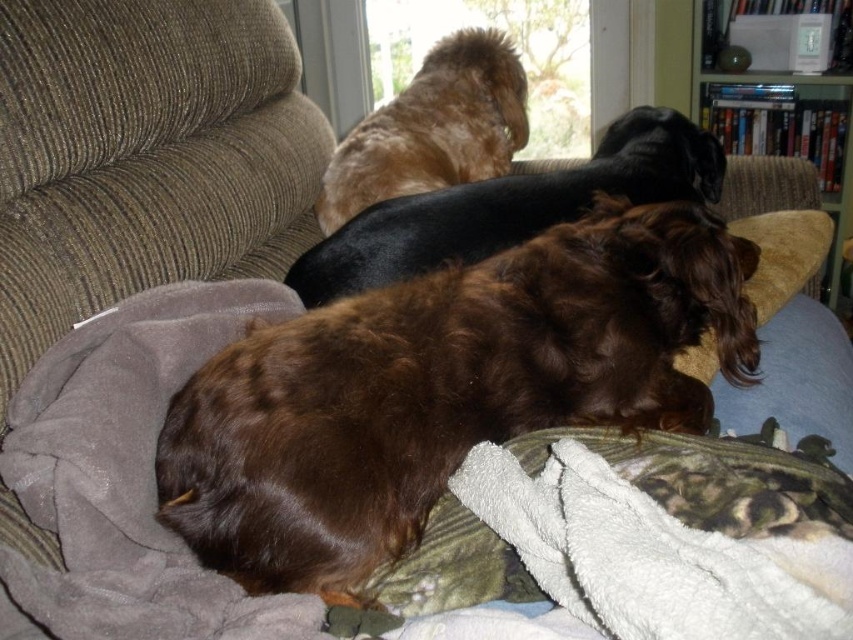
Question: Does brown fuzzy dog at center appear over shiny brown fur at upper center?

Choices:
 (A) yes
 (B) no

Answer: (B)

Question: Which point is closer to the camera taking this photo?

Choices:
 (A) (457, 268)
 (B) (296, 260)
 (C) (476, 35)

Answer: (A)

Question: Estimate the real-world distances between objects in this image. Which object is closer to the shiny black dog at center?

Choices:
 (A) wooden bookshelf at upper right
 (B) shiny brown fur at upper center

Answer: (B)

Question: Does shiny black dog at center appear on the right side of shiny brown fur at upper center?

Choices:
 (A) yes
 (B) no

Answer: (A)

Question: Can you confirm if brown fuzzy dog at center is wider than shiny brown fur at upper center?

Choices:
 (A) no
 (B) yes

Answer: (B)

Question: Which of these objects is positioned closest to the wooden bookshelf at upper right?

Choices:
 (A) shiny brown fur at upper center
 (B) brown fuzzy dog at center
 (C) shiny black dog at center

Answer: (A)